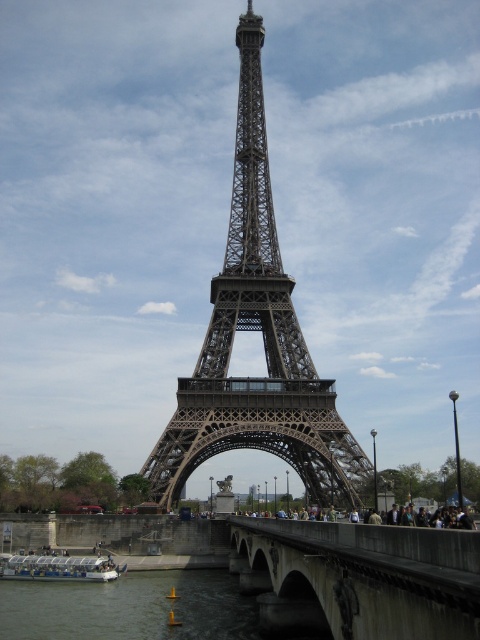
You are a tourist standing on the concrete bridge at center and want to take a photo of the Eiffel Tower. However, the smooth water at lower center might block your view. Based on their sizes, which object is more likely to obstruct your view of the Eiffel Tower?

The concrete bridge at center is larger in size compared to the smooth water at lower center, so it is more likely to obstruct your view of the Eiffel Tower.

You are standing at the base of the Eiffel Tower and want to take a photo of the smooth water at lower center and the white plastic boat at lower left. Which object should you focus on first if you want to capture both in the same frame without moving your camera?

You should focus on the smooth water at lower center first because it is closer to you than the white plastic boat at lower left, so keeping it in focus will also include the boat in the background.

You are a tourist standing on the bridge and looking at the smooth water at lower center and the white plastic boat at lower left. Which object is larger in size?

The smooth water at lower center is bigger than the white plastic boat at lower left.